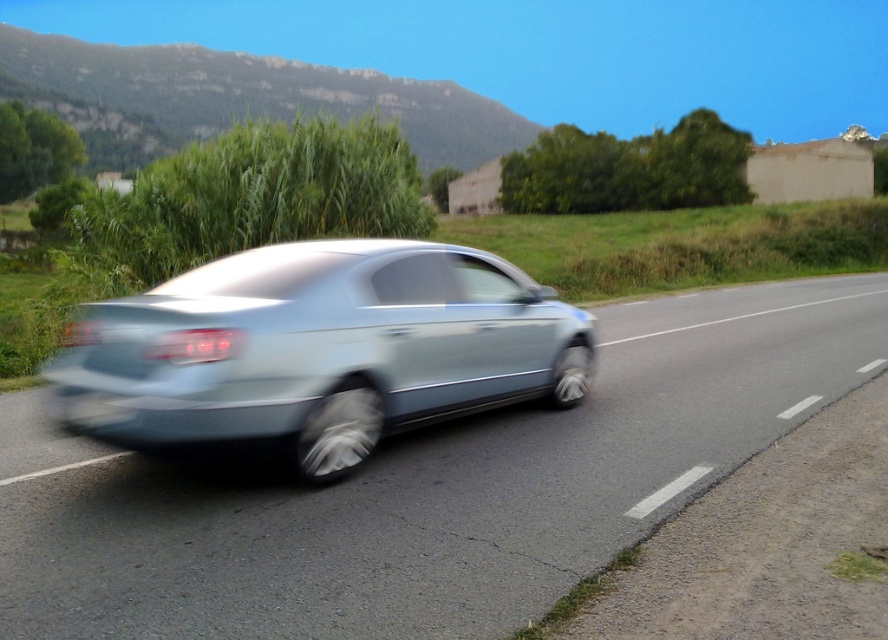
You are a pedestrian standing on the side of the road. You see the metallic silver car at center and the black rubber license plate at rear. Which object is closer to you?

The metallic silver car at center is closer to you because it is positioned under the black rubber license plate at rear, meaning the car is in front of the license plate.

You are a parking attendant and need to ensure that the satin silver car at center is properly aligned with its license plate. Based on the scene, is the car correctly positioned over the black rubber license plate at rear?

The satin silver car at center is positioned over the black rubber license plate at rear, so it is correctly aligned.

From the picture: You are a pedestrian standing on the side of the road. You see the satin silver car at center and the black rubber license plate at rear. Which object is closer to the right side of the road?

The satin silver car at center is to the right of the black rubber license plate at rear, so the satin silver car at center is closer to the right side of the road.